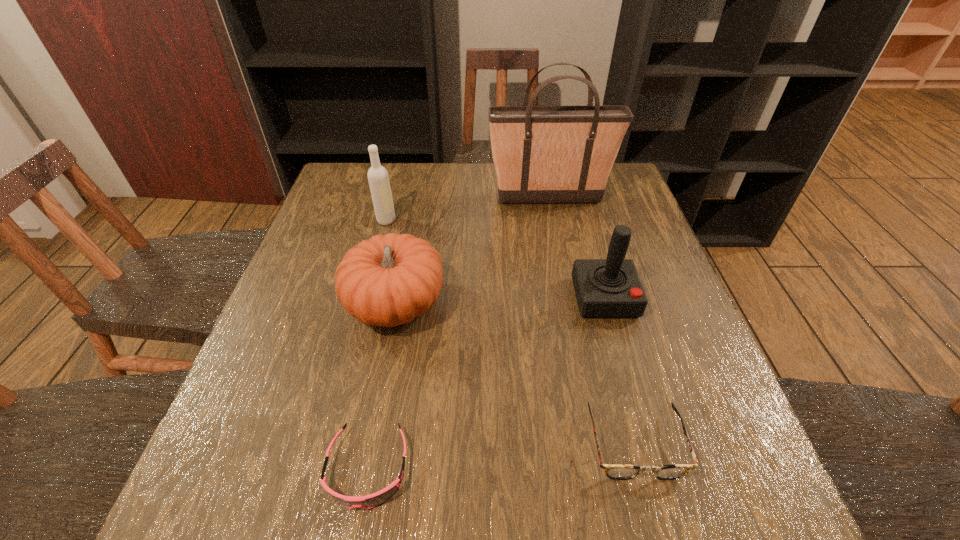
At what (x,y) coordinates should I click in order to perform the action: click on vacant region at the far edge. Please return your answer as a coordinate pair (x, y). This screenshot has height=540, width=960. Looking at the image, I should click on (398, 196).

Locate an element on the screen. free region at the near edge of the desktop is located at coordinates (318, 524).

Locate an element on the screen. The height and width of the screenshot is (540, 960). free space at the left edge of the desktop is located at coordinates (231, 406).

I want to click on vacant region at the right edge, so click(627, 347).

The width and height of the screenshot is (960, 540). Identify the location of vacant space at the far right corner of the desktop. (614, 178).

The width and height of the screenshot is (960, 540). Find the location of `blank space at the near right corner`. blank space at the near right corner is located at coordinates (749, 528).

Identify the location of unoccupied position between the second farthest object and the goggles. (377, 345).

The height and width of the screenshot is (540, 960). What are the coordinates of `unoccupied position between the vodka and the goggles` in the screenshot? It's located at (377, 345).

Find the location of `free space between the fourth tallest object and the spectacles`. free space between the fourth tallest object and the spectacles is located at coordinates (515, 375).

Identify the location of free space between the farthest object and the spectacles. point(591,321).